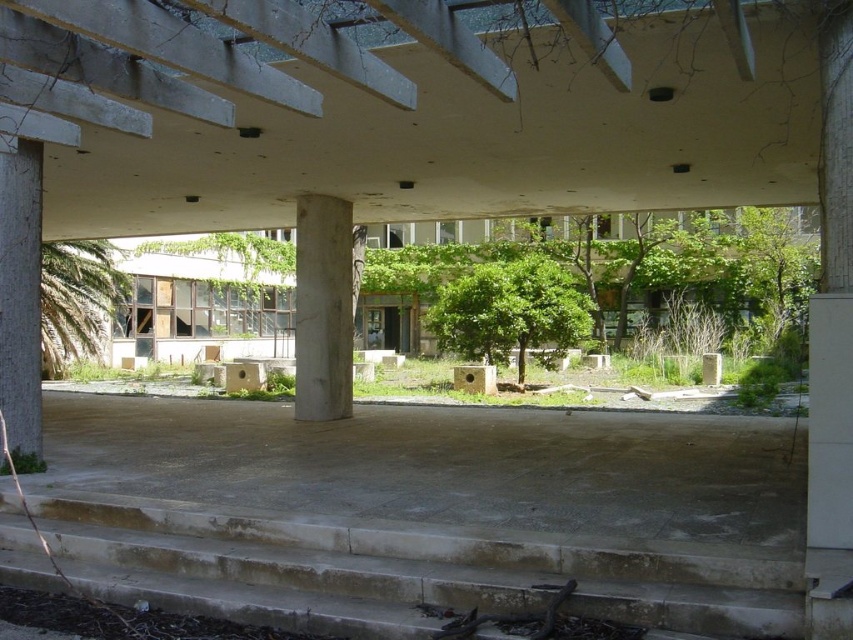
You are standing at the point labeled point at (502, 314). You need to walk to the nearest column supporting the overhang. How far will you have to walk?

The distance between you and the nearest column supporting the overhang is 20.11 meters, so you will have to walk 20.11 meters to reach it.

You are standing at the center of the image and want to walk down to the concrete stairs at lower left. In which direction should you move relative to your current position?

You should move towards the lower left direction to reach the concrete stairs at lower left.